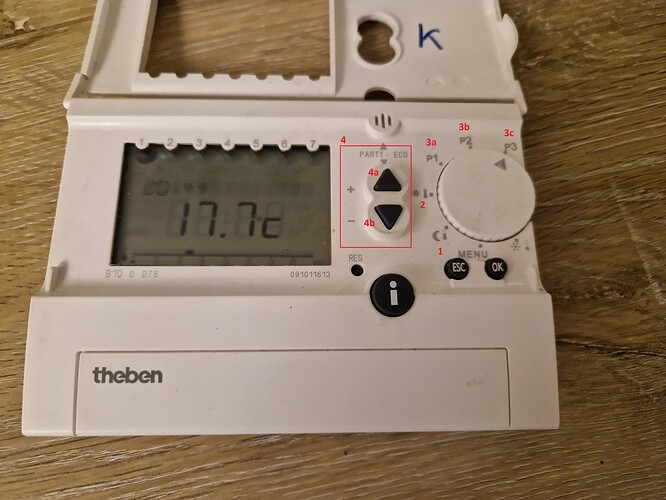
Find the location of a particular element. flipped up plastic faceplate is located at coordinates (478, 38).